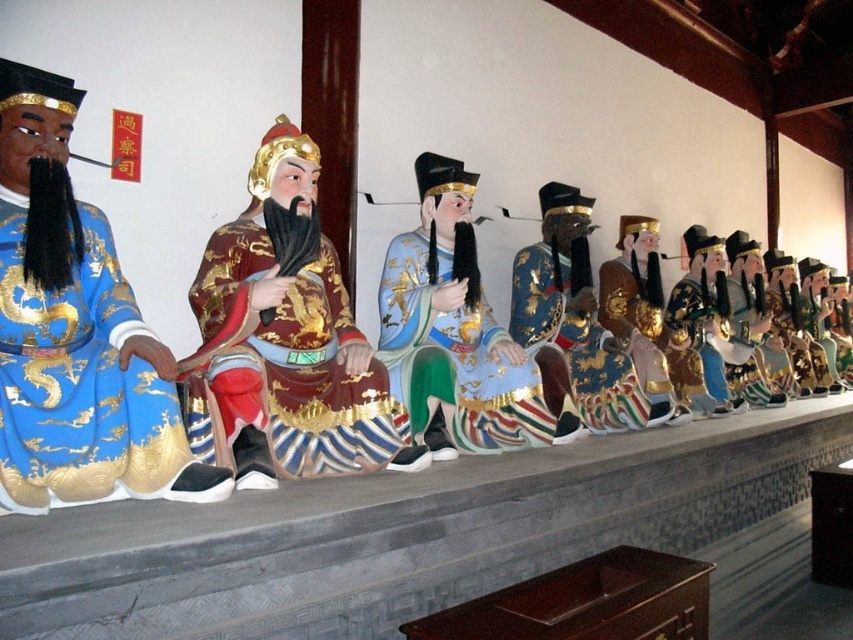
Question: Is matte gold statue at center to the right of gold leaf robe at center from the viewer's perspective?

Choices:
 (A) no
 (B) yes

Answer: (A)

Question: Which of the following is the farthest from the observer?

Choices:
 (A) (160, 435)
 (B) (653, 353)
 (C) (578, 326)
 (D) (117, 397)

Answer: (B)

Question: Which object is positioned closest to the shiny gold brocade robe at center?

Choices:
 (A) shiny blue silk robe at center
 (B) shiny blue fabric robe at center
 (C) blue silk robe at left

Answer: (C)

Question: Is blue silk robe at left further to the viewer compared to shiny blue silk robe at center?

Choices:
 (A) yes
 (B) no

Answer: (B)

Question: Can you confirm if blue silk robe at left is thinner than shiny blue silk robe at center?

Choices:
 (A) yes
 (B) no

Answer: (A)

Question: Which of the following is the closest to the observer?

Choices:
 (A) (683, 412)
 (B) (12, 253)
 (C) (292, 454)
 (D) (511, 445)

Answer: (B)